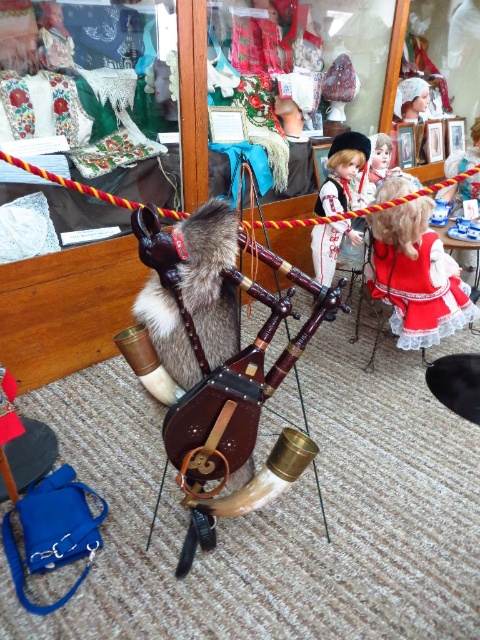
Question: Does fur-covered animal at center appear over red satin dress at center?

Choices:
 (A) yes
 (B) no

Answer: (B)

Question: Does red satin dress at center appear over matte black doll at center?

Choices:
 (A) yes
 (B) no

Answer: (B)

Question: Does red satin dress at center appear under matte black doll at center?

Choices:
 (A) yes
 (B) no

Answer: (A)

Question: Estimate the real-world distances between objects in this image. Which object is farther from the matte black doll at center?

Choices:
 (A) red satin dress at center
 (B) fur-covered animal at center

Answer: (B)

Question: Which of the following is the closest to the observer?

Choices:
 (A) (431, 241)
 (B) (222, 291)

Answer: (B)

Question: Which is nearer to the red satin dress at center?

Choices:
 (A) matte black doll at center
 (B) fur-covered animal at center

Answer: (A)